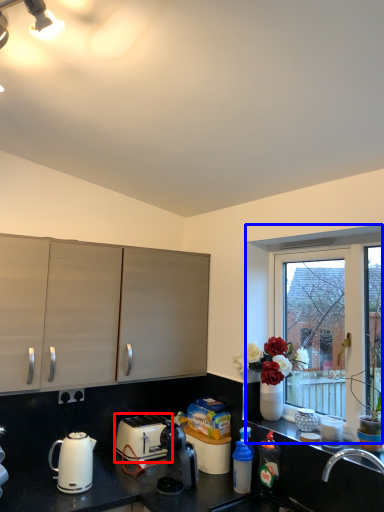
Question: Among these objects, which one is farthest to the camera, toaster (highlighted by a red box) or window (highlighted by a blue box)?

Choices:
 (A) toaster
 (B) window

Answer: (A)